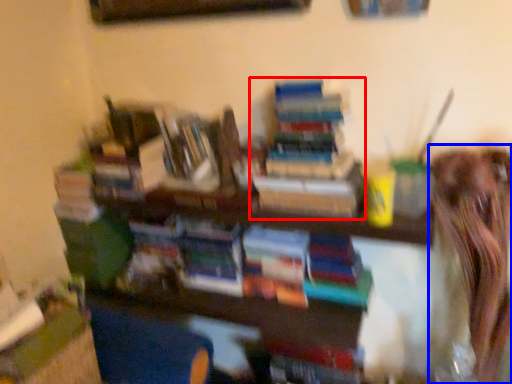
Question: Which object appears closest to the camera in this image, book (highlighted by a red box) or person (highlighted by a blue box)?

Choices:
 (A) book
 (B) person

Answer: (B)